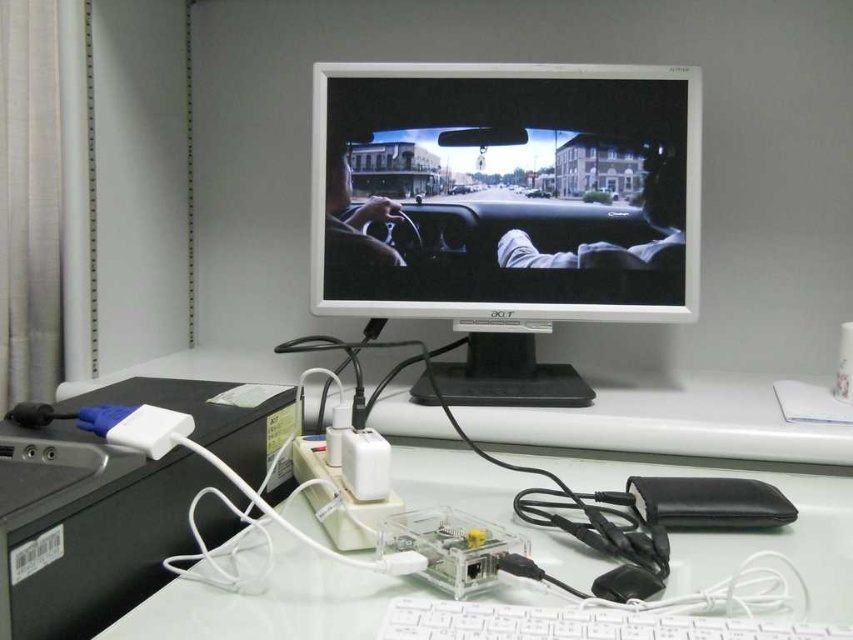
From the picture: Which of these two, white glossy monitor at center or white plastic keyboard at lower center, stands shorter?

white plastic keyboard at lower center

Is white glossy monitor at center thinner than white plastic keyboard at lower center?

Incorrect, white glossy monitor at center's width is not less than white plastic keyboard at lower center's.

Locate an element on the screen. white glossy monitor at center is located at coordinates (506, 205).

Does clear plastic electronics at center appear on the left side of white plastic keyboard at lower center?

Correct, you'll find clear plastic electronics at center to the left of white plastic keyboard at lower center.

Can you confirm if clear plastic electronics at center is wider than white plastic keyboard at lower center?

Yes.

Locate an element on the screen. This screenshot has height=640, width=853. clear plastic electronics at center is located at coordinates (267, 604).

This screenshot has width=853, height=640. In order to click on clear plastic electronics at center in this screenshot , I will do `click(267, 604)`.

Who is positioned more to the right, white glossy monitor at center or clear plastic electronics at center?

From the viewer's perspective, clear plastic electronics at center appears more on the right side.

You are a GUI agent. You are given a task and a screenshot of the screen. Output one action in this format:
    pyautogui.click(x=<x>, y=<y>)
    Task: Click on the white glossy monitor at center
    
    Given the screenshot: What is the action you would take?
    pyautogui.click(x=506, y=205)